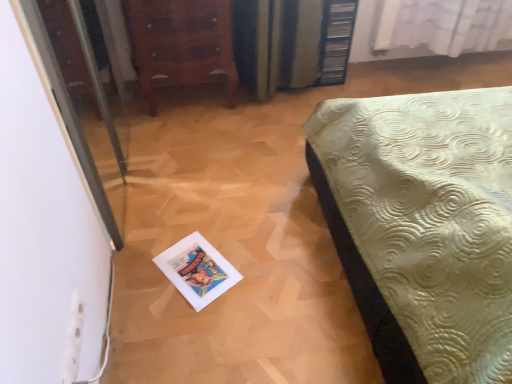
Question: Considering the relative positions of transparent glass screen door at left and white sheer curtain at upper right in the image provided, is transparent glass screen door at left to the left of white sheer curtain at upper right from the viewer's perspective?

Choices:
 (A) no
 (B) yes

Answer: (B)

Question: From a real-world perspective, is transparent glass screen door at left positioned over white sheer curtain at upper right based on gravity?

Choices:
 (A) yes
 (B) no

Answer: (A)

Question: Can you confirm if transparent glass screen door at left is smaller than white sheer curtain at upper right?

Choices:
 (A) no
 (B) yes

Answer: (A)

Question: From a real-world perspective, is transparent glass screen door at left physically below white sheer curtain at upper right?

Choices:
 (A) no
 (B) yes

Answer: (A)

Question: Considering the relative positions of transparent glass screen door at left and white sheer curtain at upper right in the image provided, is transparent glass screen door at left to the right of white sheer curtain at upper right from the viewer's perspective?

Choices:
 (A) yes
 (B) no

Answer: (B)

Question: Is white sheer curtain at upper right at the back of transparent glass screen door at left?

Choices:
 (A) no
 (B) yes

Answer: (A)

Question: Can we say transparent glass screen door at left lies outside wooden chest of drawers at upper left?

Choices:
 (A) no
 (B) yes

Answer: (B)

Question: Does transparent glass screen door at left have a larger size compared to wooden chest of drawers at upper left?

Choices:
 (A) yes
 (B) no

Answer: (B)

Question: Could you tell me if transparent glass screen door at left is turned towards wooden chest of drawers at upper left?

Choices:
 (A) yes
 (B) no

Answer: (B)

Question: Is transparent glass screen door at left with wooden chest of drawers at upper left?

Choices:
 (A) yes
 (B) no

Answer: (B)

Question: From the image's perspective, is transparent glass screen door at left below wooden chest of drawers at upper left?

Choices:
 (A) yes
 (B) no

Answer: (A)

Question: Is transparent glass screen door at left oriented away from wooden chest of drawers at upper left?

Choices:
 (A) no
 (B) yes

Answer: (A)

Question: Is wooden chest of drawers at upper left closer to camera compared to transparent glass screen door at left?

Choices:
 (A) yes
 (B) no

Answer: (B)